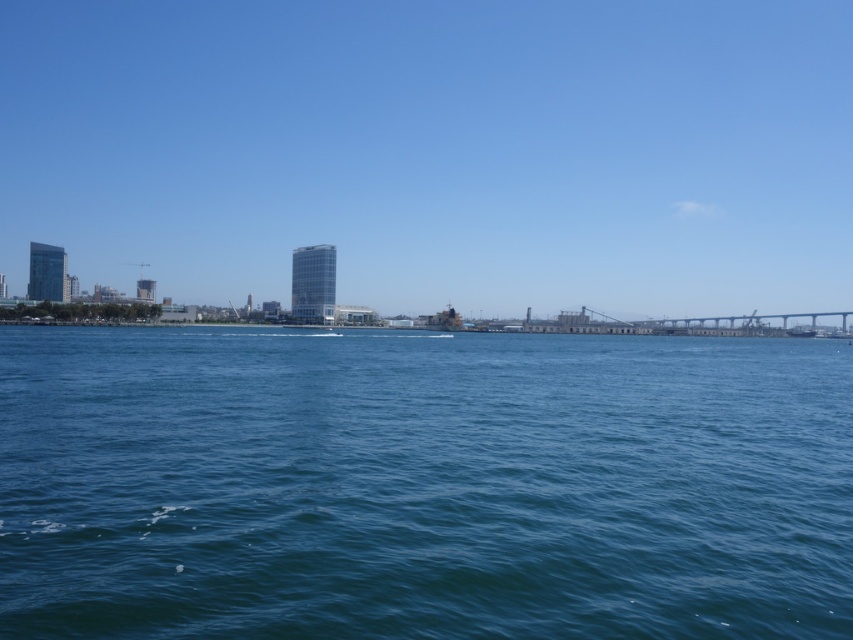
Question: Among these points, which one is farthest from the camera?

Choices:
 (A) (637, 44)
 (B) (828, 310)
 (C) (263, 428)

Answer: (A)

Question: Can you confirm if blue water at center is thinner than transparent glass skyscraper at center?

Choices:
 (A) no
 (B) yes

Answer: (B)

Question: Is blue water at center above concrete gray bridge at right?

Choices:
 (A) yes
 (B) no

Answer: (B)

Question: Estimate the real-world distances between objects in this image. Which object is farther from the transparent glass skyscraper at center?

Choices:
 (A) blue water at center
 (B) concrete gray bridge at right

Answer: (A)

Question: Observing the image, what is the correct spatial positioning of blue water at center in reference to transparent glass skyscraper at center?

Choices:
 (A) above
 (B) below

Answer: (B)

Question: Which object is the farthest from the concrete gray bridge at right?

Choices:
 (A) transparent glass skyscraper at center
 (B) blue water at center

Answer: (B)